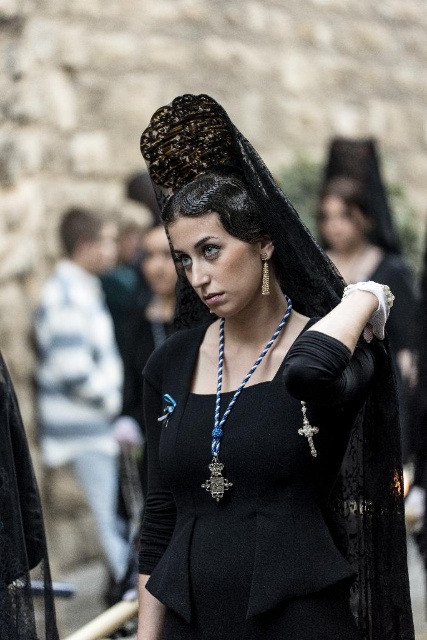
Question: Can you confirm if black woolen dress at center is positioned to the right of black velvet headdress at upper center?

Choices:
 (A) yes
 (B) no

Answer: (A)

Question: Which of these objects is positioned farthest from the black velvet headdress at upper center?

Choices:
 (A) black woolen dress at center
 (B) blue corded necklace at center

Answer: (A)

Question: Which point is farther to the camera?

Choices:
 (A) (239, 387)
 (B) (184, 506)

Answer: (B)

Question: Can you confirm if black velvet headdress at upper center is wider than blue corded necklace at center?

Choices:
 (A) no
 (B) yes

Answer: (B)

Question: Is black velvet headdress at upper center to the right of blue corded necklace at center from the viewer's perspective?

Choices:
 (A) no
 (B) yes

Answer: (A)

Question: Which of these objects is positioned farthest from the black woolen dress at center?

Choices:
 (A) blue corded necklace at center
 (B) black velvet headdress at upper center

Answer: (B)